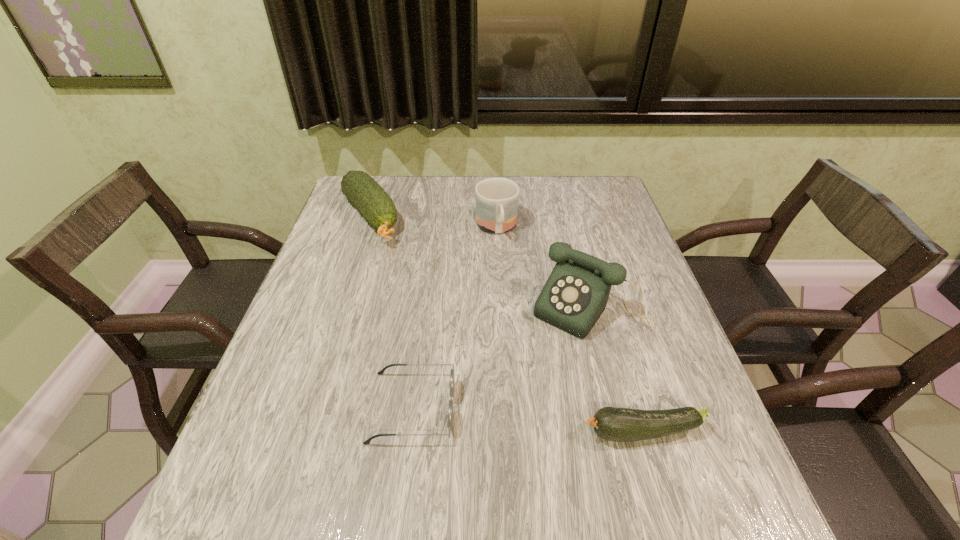
Where is `vacant space at the near edge of the desktop`? The height and width of the screenshot is (540, 960). vacant space at the near edge of the desktop is located at coordinates (564, 433).

Where is `free space at the left edge`? free space at the left edge is located at coordinates (367, 232).

You are a GUI agent. You are given a task and a screenshot of the screen. Output one action in this format:
    pyautogui.click(x=<x>, y=<y>)
    Task: Click on the vacant space at the right edge of the desktop
    Image resolution: width=960 pixels, height=540 pixels.
    Given the screenshot: What is the action you would take?
    pyautogui.click(x=623, y=283)

At what (x,y) coordinates should I click in order to perform the action: click on vacant space at the far right corner of the desktop. Please return your answer as a coordinate pair (x, y). The height and width of the screenshot is (540, 960). Looking at the image, I should click on (612, 190).

Locate an element on the screen. The width and height of the screenshot is (960, 540). free spot between the mug and the second object from left to right is located at coordinates (454, 318).

The width and height of the screenshot is (960, 540). I want to click on free space between the third nearest object and the sunglasses, so click(x=502, y=358).

Locate an element on the screen. The height and width of the screenshot is (540, 960). free space between the zucchini and the second object from left to right is located at coordinates (527, 420).

I want to click on free spot between the sunglasses and the third tallest object, so click(x=391, y=313).

The width and height of the screenshot is (960, 540). I want to click on vacant space that's between the zucchini and the telephone, so click(x=617, y=370).

Find the location of a particular element. The height and width of the screenshot is (540, 960). free space between the fourth object from right to left and the zucchini is located at coordinates (x=527, y=420).